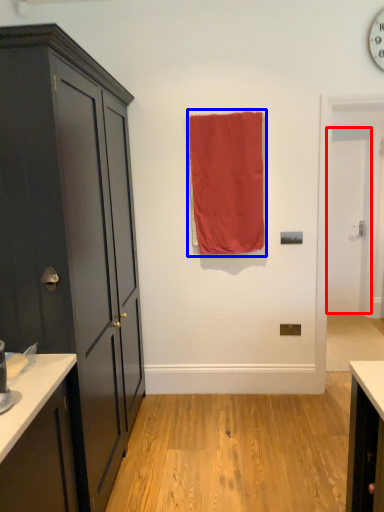
Question: Which point is further to the camera, door (highlighted by a red box) or curtain (highlighted by a blue box)?

Choices:
 (A) door
 (B) curtain

Answer: (A)